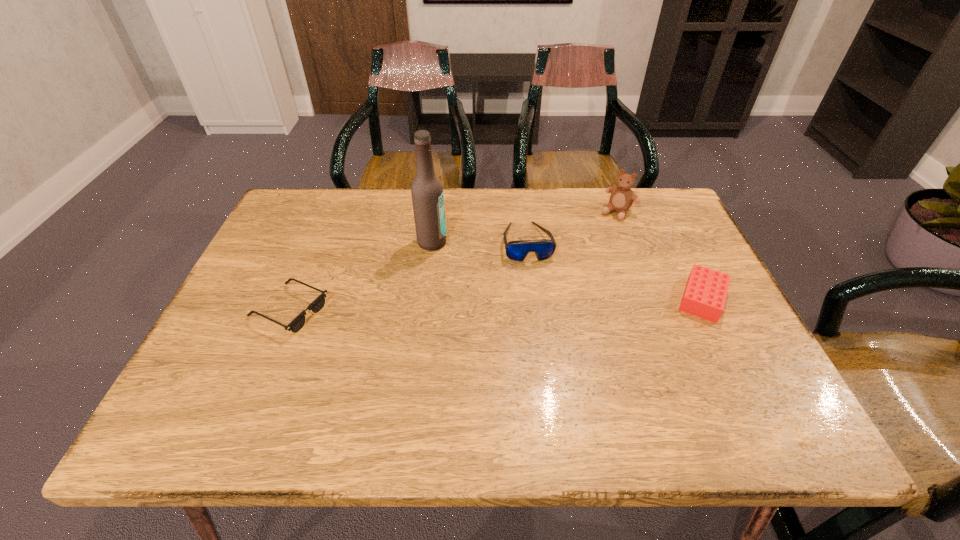
The height and width of the screenshot is (540, 960). In order to click on vacant space that's between the farther sunglasses and the second tallest object in this screenshot , I will do `click(572, 227)`.

Where is `free space between the fourth object from right to left and the Lego`? free space between the fourth object from right to left and the Lego is located at coordinates (567, 271).

I want to click on vacant area that lies between the farthest object and the fourth tallest object, so click(660, 255).

Locate an element on the screen. The image size is (960, 540). vacant area that lies between the third tallest object and the farthest object is located at coordinates (572, 227).

You are a GUI agent. You are given a task and a screenshot of the screen. Output one action in this format:
    pyautogui.click(x=<x>, y=<y>)
    Task: Click on the free space between the Lego and the shorter sunglasses
    
    Given the screenshot: What is the action you would take?
    pyautogui.click(x=495, y=305)

Select which object appears as the closest to the Lego. Please provide its 2D coordinates. Your answer should be formatted as a tuple, i.e. [(x, y)], where the tuple contains the x and y coordinates of a point satisfying the conditions above.

[(621, 199)]

Identify which object is located as the fourth nearest to the third object from left to right. Please provide its 2D coordinates. Your answer should be formatted as a tuple, i.e. [(x, y)], where the tuple contains the x and y coordinates of a point satisfying the conditions above.

[(317, 305)]

Image resolution: width=960 pixels, height=540 pixels. In order to click on vacant region that satisfies the following two spatial constraints: 1. on the front side of the Lego; 2. on the right side of the fourth shortest object in this screenshot , I will do `click(651, 299)`.

This screenshot has width=960, height=540. In order to click on vacant region that satisfies the following two spatial constraints: 1. on the back side of the second object from right to left; 2. on the left side of the third object from right to left in this screenshot , I will do `click(523, 212)`.

You are a GUI agent. You are given a task and a screenshot of the screen. Output one action in this format:
    pyautogui.click(x=<x>, y=<y>)
    Task: Click on the free space that satisfies the following two spatial constraints: 1. on the back side of the second tallest object; 2. on the right side of the tallest object
    This screenshot has height=540, width=960.
    Given the screenshot: What is the action you would take?
    pyautogui.click(x=436, y=212)